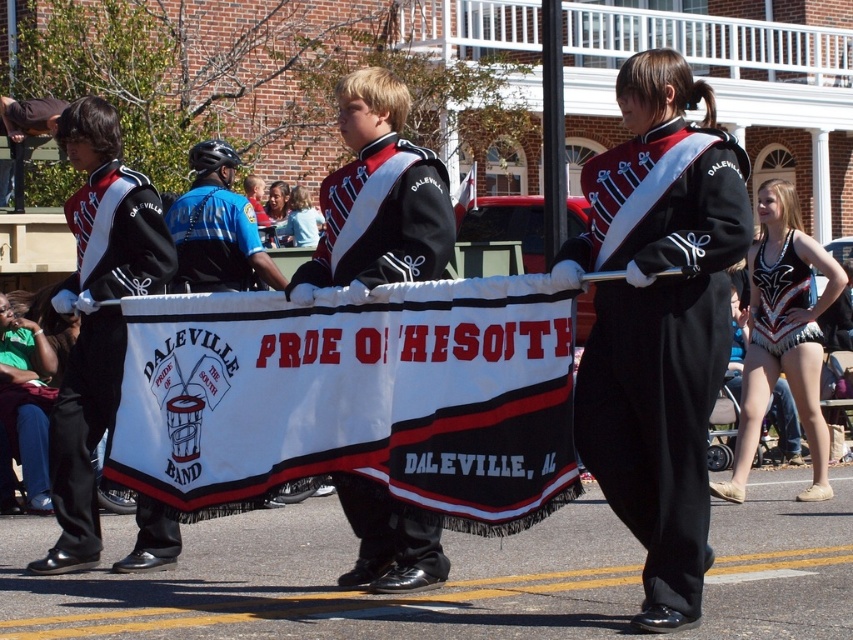
Is matte black uniform at left to the left of black satin jacket at center from the viewer's perspective?

Yes, matte black uniform at left is to the left of black satin jacket at center.

Is matte black uniform at left closer to the viewer compared to black satin jacket at center?

No.

Does point (82, 204) lie behind point (334, 200)?

Yes.

This screenshot has width=853, height=640. I want to click on matte black uniform at left, so click(x=84, y=426).

Is white fabric banner at center to the right of blue fabric shirt at upper left from the viewer's perspective?

Indeed, white fabric banner at center is positioned on the right side of blue fabric shirt at upper left.

Who is more distant from viewer, (540, 513) or (207, 209)?

The point (207, 209) is more distant.

This screenshot has width=853, height=640. Describe the element at coordinates (352, 397) in the screenshot. I see `white fabric banner at center` at that location.

Image resolution: width=853 pixels, height=640 pixels. Find the location of `white fabric banner at center`. white fabric banner at center is located at coordinates (352, 397).

Between matte black uniform at center and black spandex leotard at right, which one has more height?

matte black uniform at center is taller.

Is matte black uniform at center above black spandex leotard at right?

Actually, matte black uniform at center is below black spandex leotard at right.

Who is more distant from viewer, (x=668, y=289) or (x=767, y=291)?

Positioned behind is point (x=767, y=291).

Locate an element on the screen. This screenshot has height=640, width=853. matte black uniform at center is located at coordinates (659, 342).